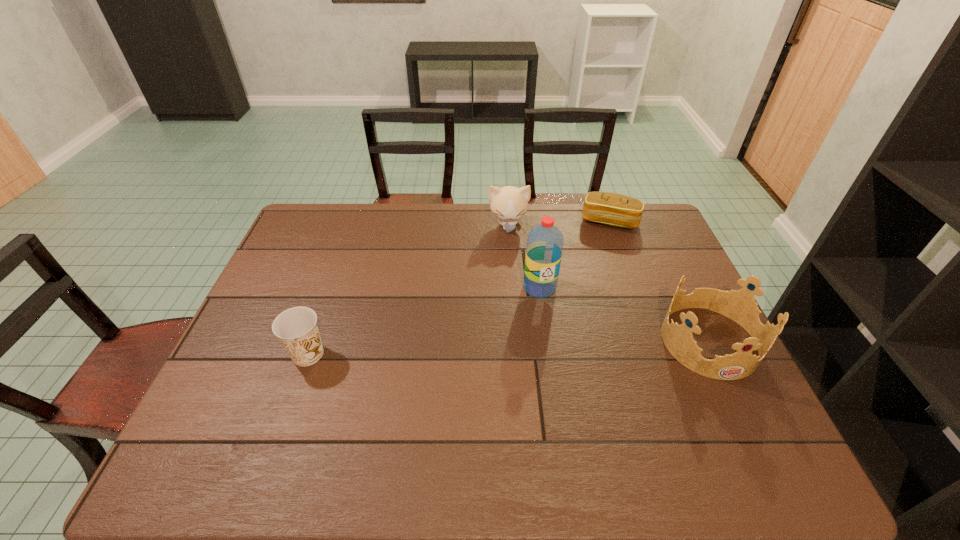
This screenshot has height=540, width=960. Identify the location of free location that satisfies the following two spatial constraints: 1. on the back side of the shortest object; 2. on the right side of the fourth tallest object. (354, 221).